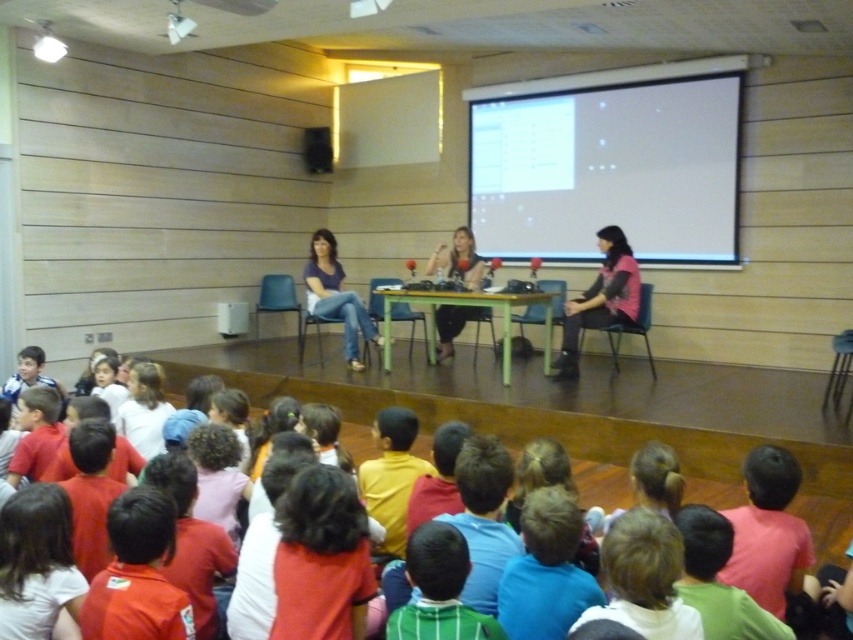
You are a student sitting in the classroom and need to see both the white matte projection screen at upper center and the matte black table at center clearly. Which object is located above the other?

The white matte projection screen at upper center is positioned over matte black table at center, so the projection screen is above the table.

You are a student sitting in the classroom facing the stage. You notice the pink fabric shirt at center and the matte black table at center. Which object takes up more visual space in the scene?

The pink fabric shirt at center is larger in size than the matte black table at center, so it takes up more visual space in the scene.

What is located at the point with coordinates (608,170) in the classroom scene?

The point at coordinates (608,170) is occupied by the white matte projection screen at upper center.